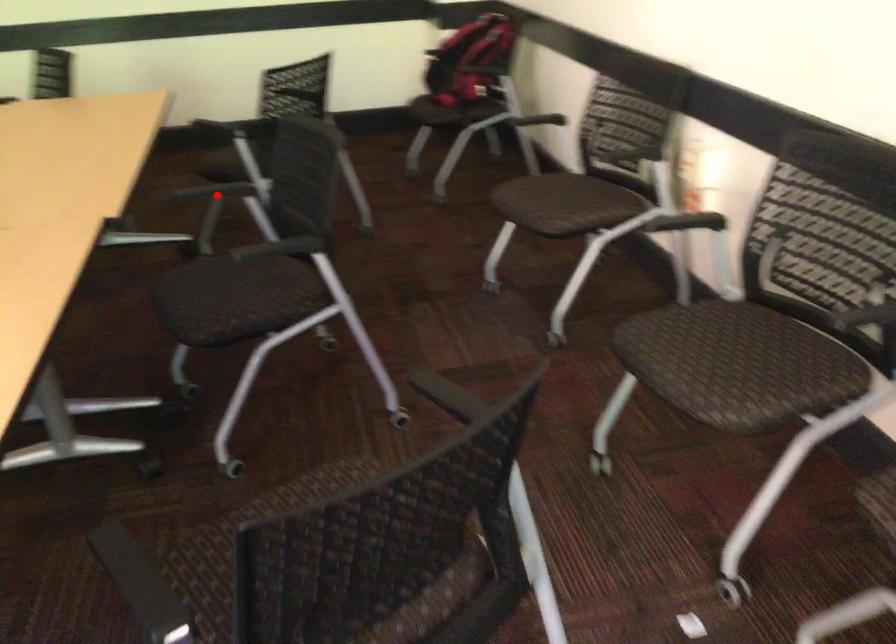
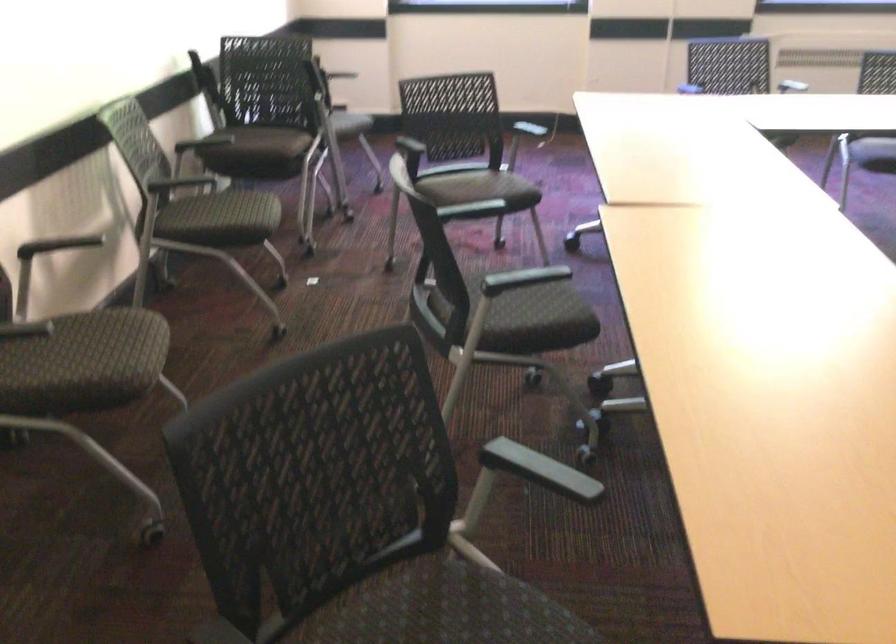
Question: I am providing you with two images of the same scene from different viewpoints. In image1, a red point is highlighted. Considering the same 3D point in image2, which of the following is correct?

Choices:
 (A) It is closer
 (B) It is farther

Answer: (A)